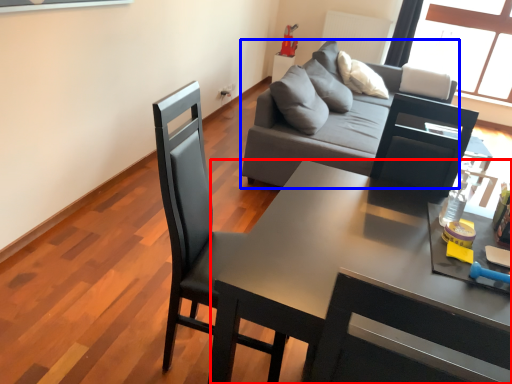
Question: Among these objects, which one is farthest to the camera, desk (highlighted by a red box) or studio couch (highlighted by a blue box)?

Choices:
 (A) desk
 (B) studio couch

Answer: (B)